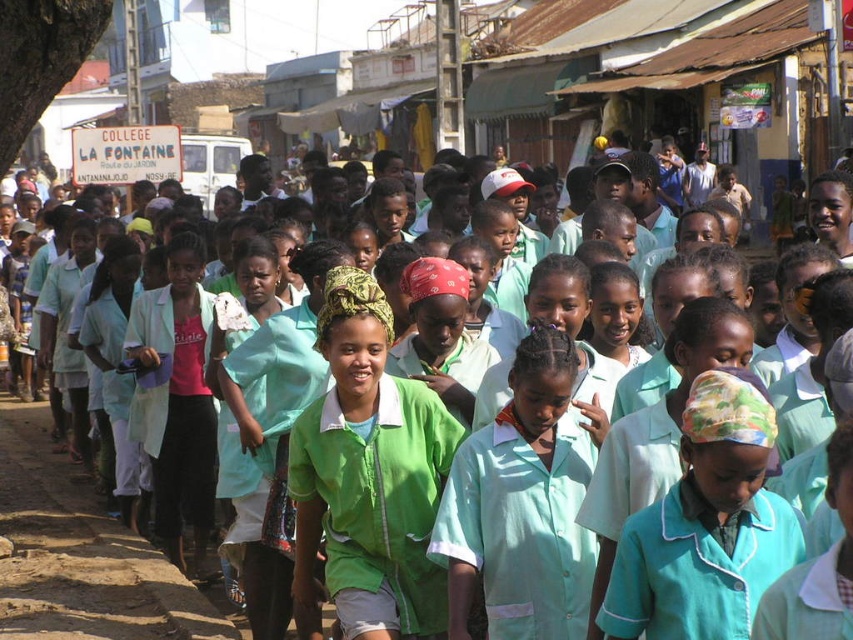
Which of these two, green fabric shirt at center or green fabric headscarf at center, stands shorter?

green fabric headscarf at center is shorter.

Between point (397, 563) and point (714, 632), which one is positioned in front?

Point (714, 632)

Is point (311, 570) farther from camera compared to point (798, 545)?

Yes.

This screenshot has height=640, width=853. I want to click on green fabric shirt at center, so click(x=368, y=477).